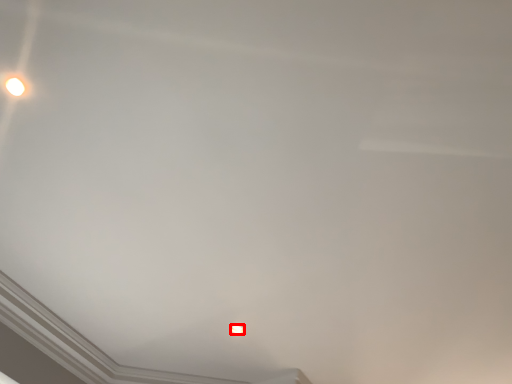
Question: From the image's perspective, where is lamp (annotated by the red box) located in relation to lamp in the image?

Choices:
 (A) above
 (B) below

Answer: (B)